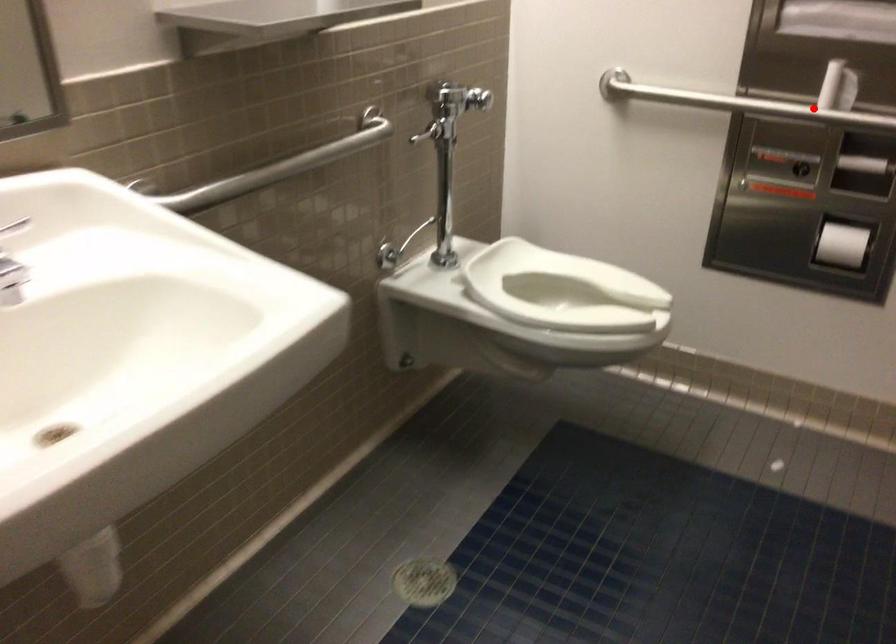
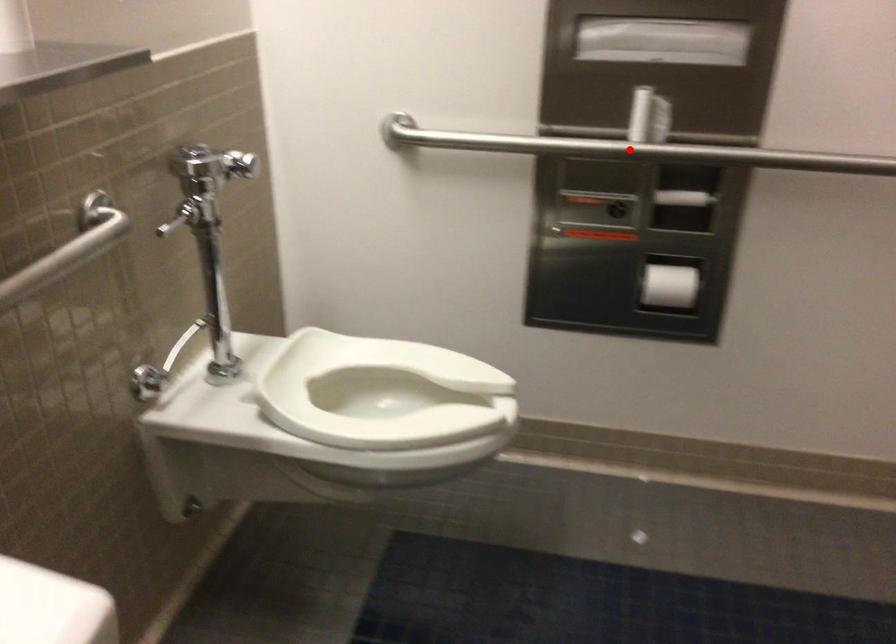
I am providing you with two images of the same scene from different viewpoints. A red point is marked on the first image and another point is marked on the second image. Are the points marked in image1 and image2 representing the same 3D position?

Yes